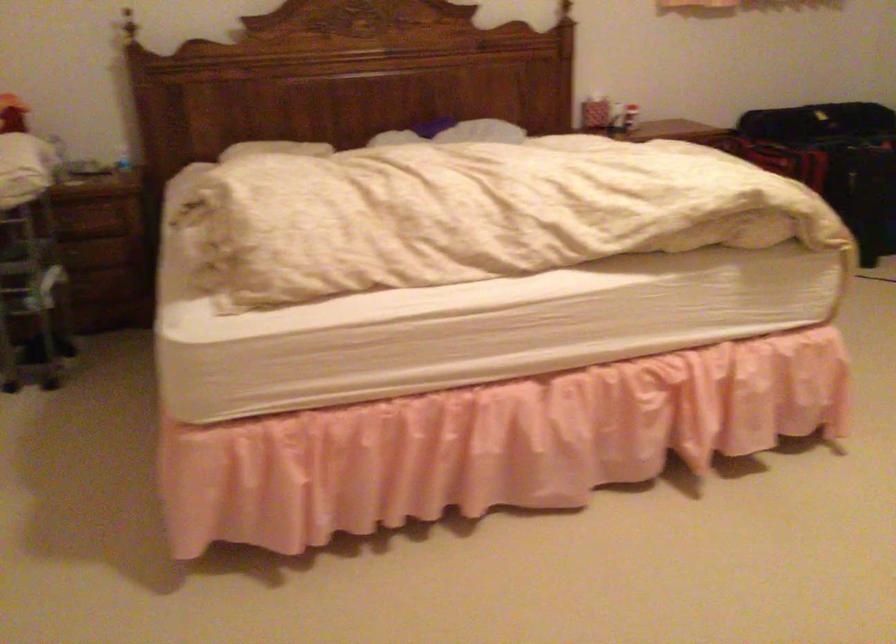
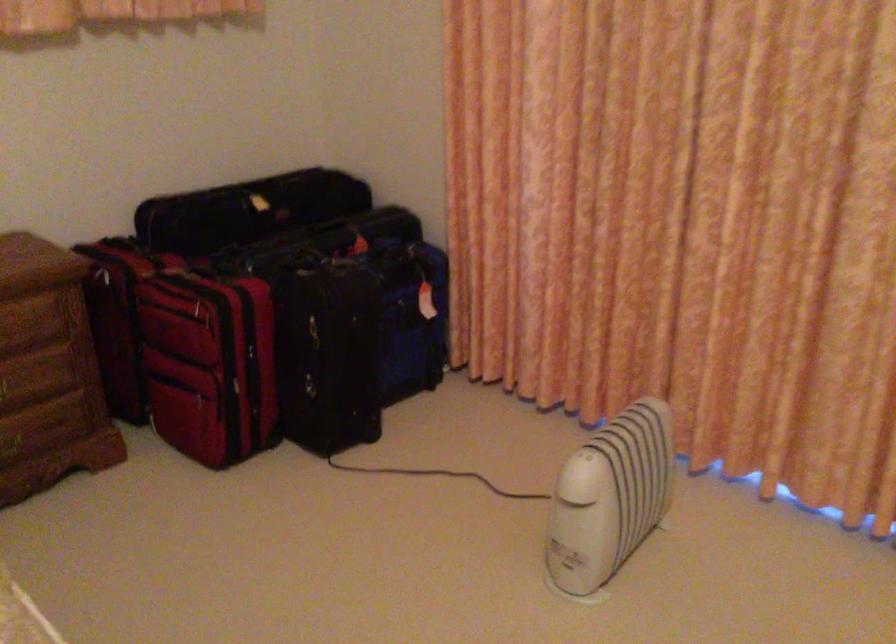
Find the pixel in the second image that matches pixel 785 174 in the first image.

(209, 364)